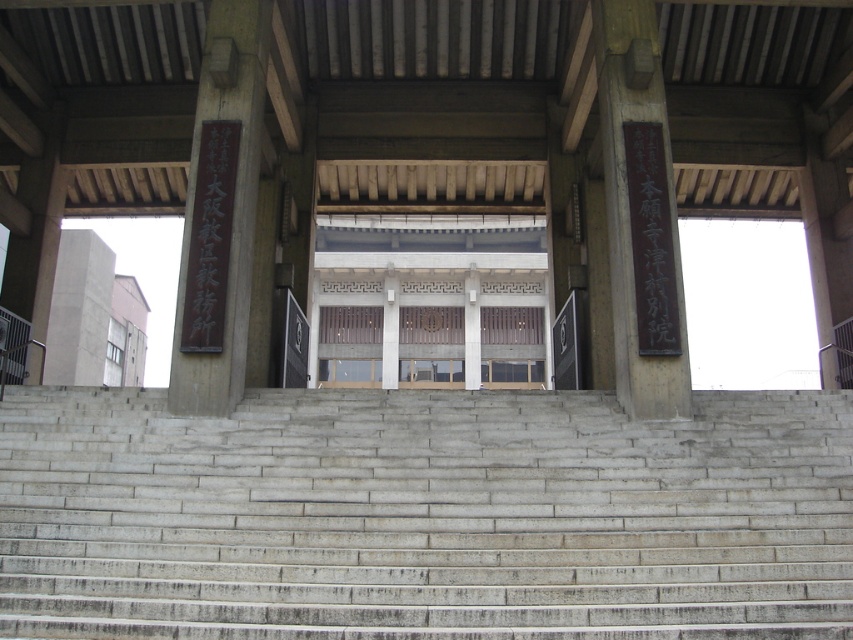
You are standing at the base of the entrance and need to locate the gray concrete stairs at center. According to the coordinates provided, where exactly would you find them?

The gray concrete stairs at center are located at point (x=424, y=515).

You are a visitor approaching the entrance of the building. You need to determine which object, the gray concrete stairs at center or the black stone sign at right, you should focus on first to locate the main entrance. Based on their sizes, which one is more likely to guide you to the entrance?

The gray concrete stairs at center is bigger than the black stone sign at right, so the gray concrete stairs at center is more likely to guide you to the entrance due to its larger size.